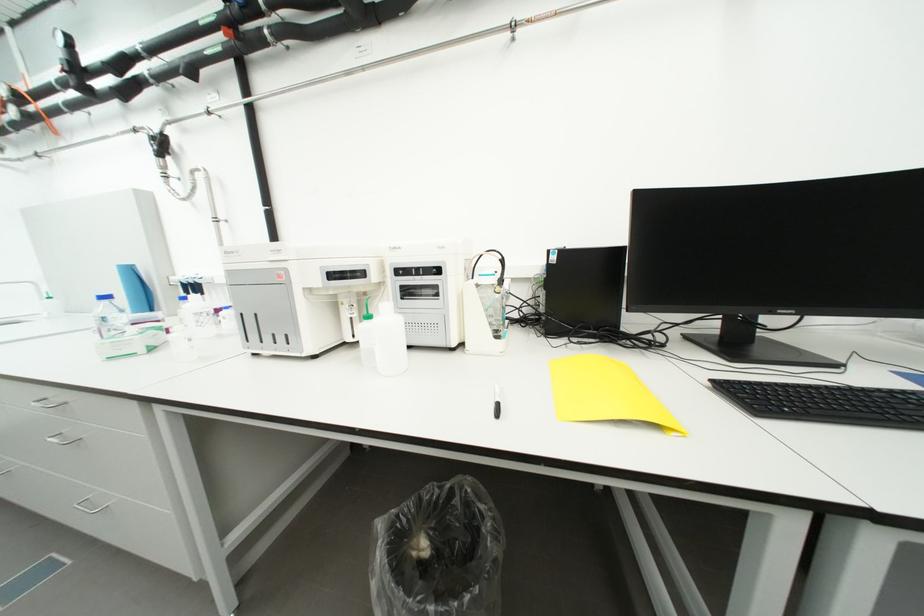
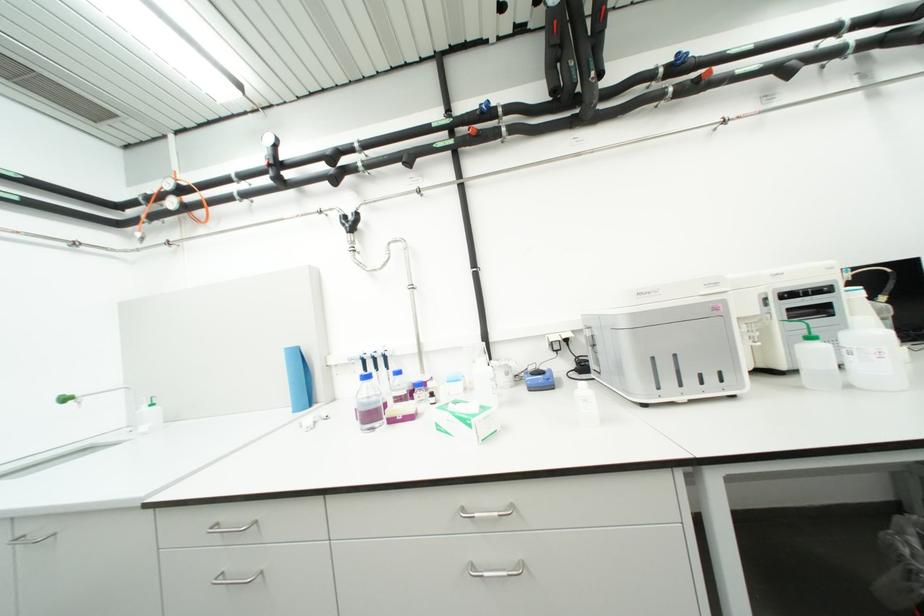
Question: Which direction would the cameraman need to move to produce the second image? Reply with the corresponding letter.

Choices:
 (A) Left
 (B) Right
 (C) Forward
 (D) Backward

Answer: (A)